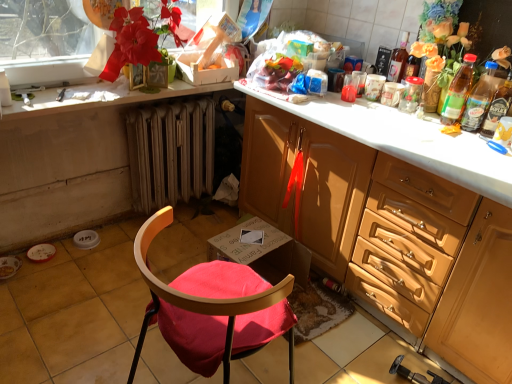
Measure the distance between metallic radiator at lower center and camera.

The depth of metallic radiator at lower center is 2.06 meters.

What is the approximate width of metallic radiator at lower center?

The width of metallic radiator at lower center is 5.67 inches.

Image resolution: width=512 pixels, height=384 pixels. What do you see at coordinates (398, 60) in the screenshot?
I see `translucent glass bottle at upper right, acting as the 1th bottle starting from the left` at bounding box center [398, 60].

In order to click on transparent plastic jar at upper right in this screenshot , I will do tap(411, 95).

The width and height of the screenshot is (512, 384). Describe the element at coordinates (45, 41) in the screenshot. I see `transparent plastic window screen at upper left` at that location.

Describe the element at coordinates (458, 91) in the screenshot. I see `translucent plastic bottle at upper right, which ranks as the 2th bottle in left-to-right order` at that location.

The height and width of the screenshot is (384, 512). Identify the location of matte red flower at upper left. (140, 37).

From the picture: From the image's perspective, is translucent glass bottle at upper right, arranged as the 4th bottle when viewed from the right, located above wooden cabinet at right?

Yes, from the image's perspective, translucent glass bottle at upper right, arranged as the 4th bottle when viewed from the right, is above wooden cabinet at right.

Does point (401, 75) come farther from viewer compared to point (377, 178)?

Yes, point (401, 75) is behind point (377, 178).

Is translucent glass bottle at upper right, acting as the 1th bottle starting from the left, positioned beyond the bounds of wooden cabinet at right?

Yes, translucent glass bottle at upper right, acting as the 1th bottle starting from the left, is outside of wooden cabinet at right.

How distant is translucent glass bottle at upper right, acting as the 1th bottle starting from the left, from wooden cabinet at right?

translucent glass bottle at upper right, acting as the 1th bottle starting from the left, and wooden cabinet at right are 29.97 inches apart from each other.

In terms of width, does velvet red chair at lower left look wider or thinner when compared to transparent plastic window screen at upper left?

In the image, velvet red chair at lower left appears to be wider than transparent plastic window screen at upper left.

Identify the location of window screen that appears on the left of velvet red chair at lower left. (45, 41).

Relative to transparent plastic window screen at upper left, is velvet red chair at lower left in front or behind?

velvet red chair at lower left is in front of transparent plastic window screen at upper left.

Considering the sizes of velvet red chair at lower left and transparent plastic window screen at upper left in the image, is velvet red chair at lower left bigger or smaller than transparent plastic window screen at upper left?

Clearly, velvet red chair at lower left is larger in size than transparent plastic window screen at upper left.

Between matte red flower at upper left and translucent plastic bottle at right, which is the 3th bottle from left to right, which one has larger size?

matte red flower at upper left.

From a real-world perspective, which object rests below the other?

From a 3D spatial view, translucent plastic bottle at right, the 2th bottle positioned from the right, is below.

From the image's perspective, is matte red flower at upper left over translucent plastic bottle at right, which is the 3th bottle from left to right?

Yes, from the image's perspective, matte red flower at upper left is over translucent plastic bottle at right, which is the 3th bottle from left to right.

Considering the sizes of objects translucent plastic bottle at upper right, which appears as the third bottle when viewed from the right, and wooden cabinet at right in the image provided, who is shorter, translucent plastic bottle at upper right, which appears as the third bottle when viewed from the right, or wooden cabinet at right?

translucent plastic bottle at upper right, which appears as the third bottle when viewed from the right, is shorter.

From the image's perspective, would you say translucent plastic bottle at upper right, which appears as the third bottle when viewed from the right, is positioned over wooden cabinet at right?

Yes, from the image's perspective, translucent plastic bottle at upper right, which appears as the third bottle when viewed from the right, is on top of wooden cabinet at right.

In the scene shown: Between translucent plastic bottle at upper right, which ranks as the 2th bottle in left-to-right order, and wooden cabinet at right, which one has smaller size?

With smaller size is translucent plastic bottle at upper right, which ranks as the 2th bottle in left-to-right order.

Does point (456, 74) appear closer or farther from the camera than point (448, 349)?

Clearly, point (456, 74) is more distant from the camera than point (448, 349).

Is translucent glass bottle at upper right, arranged as the 4th bottle when viewed from the right, oriented towards matte red flower at upper left?

No, translucent glass bottle at upper right, arranged as the 4th bottle when viewed from the right, is not facing towards matte red flower at upper left.

Looking at this image, is translucent glass bottle at upper right, acting as the 1th bottle starting from the left, closer to the viewer compared to matte red flower at upper left?

No.

Locate an element on the screen. The height and width of the screenshot is (384, 512). bottle above the matte red flower at upper left (from a real-world perspective) is located at coordinates (398, 60).

Between translucent glass bottle at upper right, acting as the 1th bottle starting from the left, and matte red flower at upper left, which one has less height?

With less height is translucent glass bottle at upper right, acting as the 1th bottle starting from the left.

Locate an element on the screen. The height and width of the screenshot is (384, 512). flower on the left of translucent glass bottle at upper right, arranged as the 4th bottle when viewed from the right is located at coordinates (140, 37).

In the scene shown: From a real-world perspective, is matte red flower at upper left on translucent glass bottle at upper right, acting as the 1th bottle starting from the left?

No, from a real-world perspective, matte red flower at upper left is not on top of translucent glass bottle at upper right, acting as the 1th bottle starting from the left.

Looking at this image, is matte red flower at upper left outside of translucent glass bottle at upper right, acting as the 1th bottle starting from the left?

Indeed, matte red flower at upper left is completely outside translucent glass bottle at upper right, acting as the 1th bottle starting from the left.

Considering their positions, is matte red flower at upper left located in front of or behind translucent glass bottle at upper right, arranged as the 4th bottle when viewed from the right?

matte red flower at upper left is positioned closer to the viewer than translucent glass bottle at upper right, arranged as the 4th bottle when viewed from the right.

Considering the positions of objects transparent plastic jar at upper right and translucent plastic bottle at upper right, which ranks as the 2th bottle in left-to-right order, in the image provided, who is more to the left, transparent plastic jar at upper right or translucent plastic bottle at upper right, which ranks as the 2th bottle in left-to-right order,?

transparent plastic jar at upper right.

From a real-world perspective, is transparent plastic jar at upper right physically above translucent plastic bottle at upper right, which appears as the third bottle when viewed from the right?

No, from a real-world perspective, transparent plastic jar at upper right is not on top of translucent plastic bottle at upper right, which appears as the third bottle when viewed from the right.

Considering the sizes of objects transparent plastic jar at upper right and translucent plastic bottle at upper right, which appears as the third bottle when viewed from the right, in the image provided, who is taller, transparent plastic jar at upper right or translucent plastic bottle at upper right, which appears as the third bottle when viewed from the right,?

translucent plastic bottle at upper right, which appears as the third bottle when viewed from the right, is taller.

From the image's perspective, is transparent plastic jar at upper right beneath translucent plastic bottle at upper right, which appears as the third bottle when viewed from the right?

Incorrect, from the image's perspective, transparent plastic jar at upper right is higher than translucent plastic bottle at upper right, which appears as the third bottle when viewed from the right.

At what (x,y) coordinates should I click in order to perform the action: click on the 4th bottle positioned above the wooden cabinet at right (from a real-world perspective). Please return your answer as a coordinate pair (x, y). This screenshot has width=512, height=384. Looking at the image, I should click on (398, 60).

Where is `chair on the right of transparent plastic window screen at upper left`? The height and width of the screenshot is (384, 512). chair on the right of transparent plastic window screen at upper left is located at coordinates (212, 309).

Based on the photo, based on their spatial positions, is matte red flower at upper left or wooden cabinet at right further from metallic radiator at lower center?

wooden cabinet at right lies further to metallic radiator at lower center than the other object.

Estimate the real-world distances between objects in this image. Which object is further from white glossy countertop at upper left, translucent plastic bottle at right, which is the 3th bottle from left to right, or velvet red chair at lower left?

translucent plastic bottle at right, which is the 3th bottle from left to right, lies further to white glossy countertop at upper left than the other object.

Considering their positions, is translucent plastic bottle at right, acting as the fourth bottle starting from the left, positioned further to translucent plastic bottle at right, the 2th bottle positioned from the right, than wooden cabinet at right?

The object further to translucent plastic bottle at right, the 2th bottle positioned from the right, is wooden cabinet at right.

When comparing their distances from matte red flower at upper left, does velvet red chair at lower left or translucent plastic bottle at right, the 2th bottle positioned from the right, seem closer?

The object closer to matte red flower at upper left is velvet red chair at lower left.

Looking at the image, which one is located closer to metallic radiator at lower center, translucent plastic bottle at upper right, which ranks as the 2th bottle in left-to-right order, or white glossy countertop at upper left?

Among the two, white glossy countertop at upper left is located nearer to metallic radiator at lower center.

In the scene shown: Which object lies further to the anchor point transparent plastic window screen at upper left, translucent plastic bottle at upper right, which ranks as the 2th bottle in left-to-right order, or metallic radiator at lower center?

translucent plastic bottle at upper right, which ranks as the 2th bottle in left-to-right order, is positioned further to the anchor transparent plastic window screen at upper left.

Estimate the real-world distances between objects in this image. Which object is further from metallic radiator at lower center, translucent plastic bottle at right, the first bottle in the right-to-left sequence, or translucent plastic bottle at right, the 2th bottle positioned from the right?

The object further to metallic radiator at lower center is translucent plastic bottle at right, the first bottle in the right-to-left sequence.

Considering their positions, is translucent plastic bottle at right, which is the 3th bottle from left to right, positioned closer to transparent plastic window screen at upper left than metallic radiator at lower center?

metallic radiator at lower center lies closer to transparent plastic window screen at upper left than the other object.

Locate an element on the screen. glass jar between translucent plastic bottle at upper right, which appears as the third bottle when viewed from the right, and translucent glass bottle at upper right, acting as the 1th bottle starting from the left, in the front-back direction is located at coordinates (411, 95).

Identify the location of flower situated between transparent plastic window screen at upper left and translucent plastic bottle at upper right, which ranks as the 2th bottle in left-to-right order, from left to right. The height and width of the screenshot is (384, 512). pos(140,37).

Where is `cabinetry located between transparent plastic window screen at upper left and translucent plastic bottle at right, the first bottle in the right-to-left sequence, in the left-right direction`? cabinetry located between transparent plastic window screen at upper left and translucent plastic bottle at right, the first bottle in the right-to-left sequence, in the left-right direction is located at coordinates (390, 235).

The width and height of the screenshot is (512, 384). In order to click on radiator between transparent plastic window screen at upper left and wooden cabinet at right in the horizontal direction in this screenshot , I will do `click(170, 153)`.